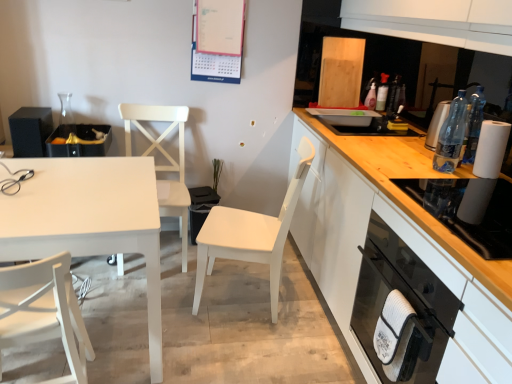
Question: Are matte paperboard calendar at upper center and translucent plastic bottle at upper right, the second bottle positioned from the front, beside each other?

Choices:
 (A) no
 (B) yes

Answer: (A)

Question: Can you confirm if matte paperboard calendar at upper center is positioned to the left of translucent plastic bottle at upper right, the 1th bottle in the top-to-bottom sequence?

Choices:
 (A) no
 (B) yes

Answer: (B)

Question: From the image's perspective, would you say matte paperboard calendar at upper center is positioned over translucent plastic bottle at upper right, the second bottle positioned from the front?

Choices:
 (A) yes
 (B) no

Answer: (A)

Question: Is translucent plastic bottle at upper right, the 1th bottle in the top-to-bottom sequence, located within matte paperboard calendar at upper center?

Choices:
 (A) yes
 (B) no

Answer: (B)

Question: Does matte paperboard calendar at upper center have a smaller size compared to translucent plastic bottle at upper right, the second bottle positioned from the front?

Choices:
 (A) yes
 (B) no

Answer: (B)

Question: Is matte paperboard calendar at upper center facing away from translucent plastic bottle at upper right, the second bottle positioned from the front?

Choices:
 (A) no
 (B) yes

Answer: (A)

Question: From a real-world perspective, is black glass oven at lower right beneath matte paperboard calendar at upper center?

Choices:
 (A) no
 (B) yes

Answer: (B)

Question: From the image's perspective, is black glass oven at lower right under matte paperboard calendar at upper center?

Choices:
 (A) yes
 (B) no

Answer: (A)

Question: Can you confirm if black glass oven at lower right is shorter than matte paperboard calendar at upper center?

Choices:
 (A) no
 (B) yes

Answer: (A)

Question: Is black glass oven at lower right facing towards matte paperboard calendar at upper center?

Choices:
 (A) no
 (B) yes

Answer: (A)

Question: Is black glass oven at lower right to the left of matte paperboard calendar at upper center from the viewer's perspective?

Choices:
 (A) no
 (B) yes

Answer: (A)

Question: Does black glass oven at lower right have a larger size compared to matte paperboard calendar at upper center?

Choices:
 (A) no
 (B) yes

Answer: (B)

Question: Is black matte speaker at left, placed as the third appliance when sorted from front to back, at the back of clear plastic bottle at right, the second bottle in the top-to-bottom sequence?

Choices:
 (A) yes
 (B) no

Answer: (B)